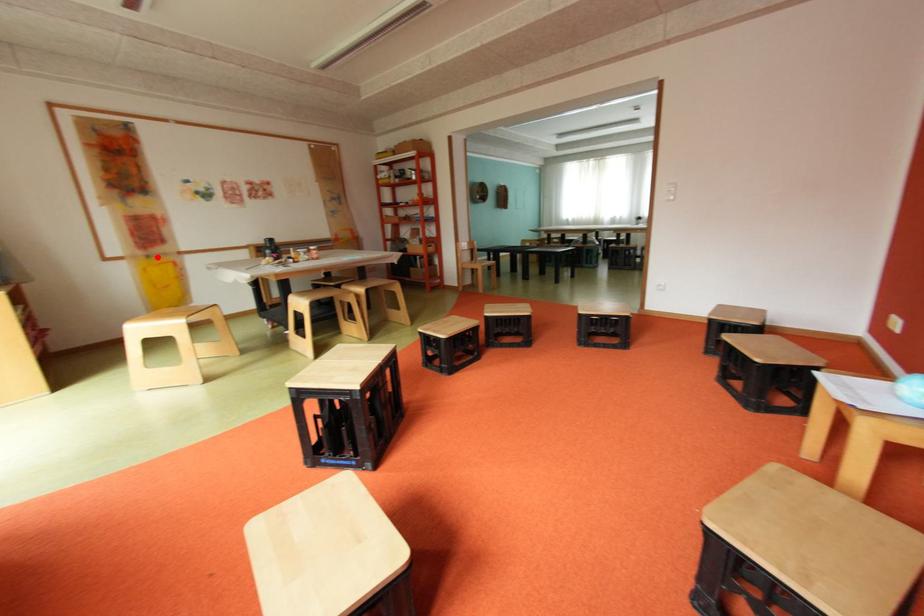
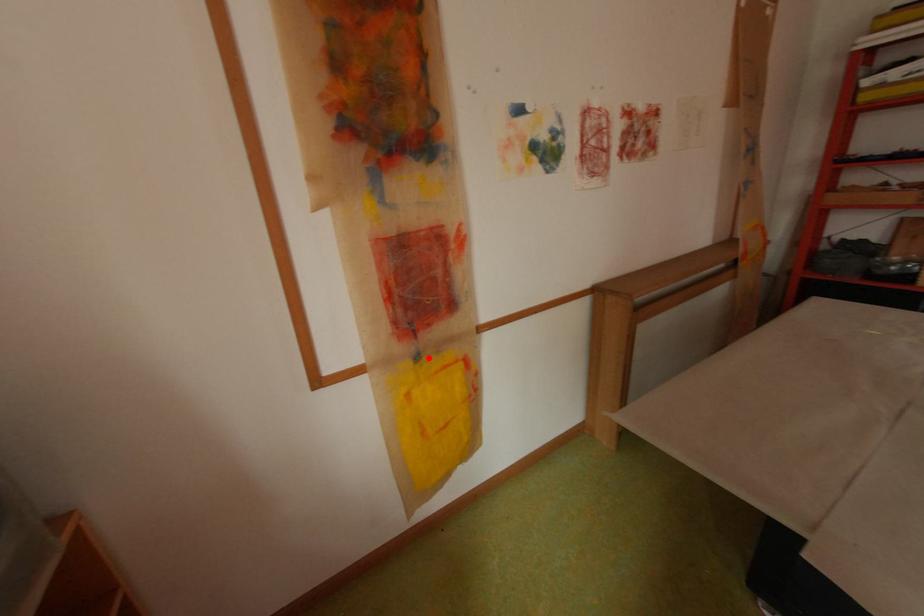
I am providing you with two images of the same scene from different viewpoints. A red point is marked on the first image and another point is marked on the second image. Do the highlighted points in image1 and image2 indicate the same real-world spot?

Yes